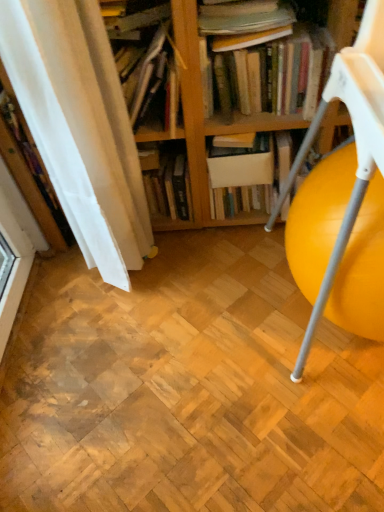
Question: Is yellow plastic ball at right closer to camera compared to hardcover books at upper center, which appears as the 3th book when viewed from the left?

Choices:
 (A) yes
 (B) no

Answer: (A)

Question: Can we say yellow plastic ball at right lies outside hardcover books at upper center, which appears as the 3th book when viewed from the left?

Choices:
 (A) yes
 (B) no

Answer: (A)

Question: Can you confirm if yellow plastic ball at right is positioned to the right of hardcover books at upper center, the first book viewed from the right?

Choices:
 (A) yes
 (B) no

Answer: (A)

Question: Is yellow plastic ball at right smaller than hardcover books at upper center, the first book viewed from the right?

Choices:
 (A) yes
 (B) no

Answer: (B)

Question: From the image's perspective, is yellow plastic ball at right on top of hardcover books at upper center, which appears as the 3th book when viewed from the left?

Choices:
 (A) no
 (B) yes

Answer: (A)

Question: From a real-world perspective, is hardcover book at center, which appears as the second book when viewed from the right, above or below wooden bookshelf at upper center, positioned as the third book in right-to-left order?

Choices:
 (A) below
 (B) above

Answer: (A)

Question: In the image, is hardcover book at center, which appears as the second book when viewed from the right, on the left side or the right side of wooden bookshelf at upper center, positioned as the third book in right-to-left order?

Choices:
 (A) left
 (B) right

Answer: (B)

Question: Considering the positions of hardcover book at center, which appears as the second book when viewed from the right, and wooden bookshelf at upper center, positioned as the third book in right-to-left order, in the image, is hardcover book at center, which appears as the second book when viewed from the right, taller or shorter than wooden bookshelf at upper center, positioned as the third book in right-to-left order,?

Choices:
 (A) short
 (B) tall

Answer: (A)

Question: Does point (150, 193) appear closer or farther from the camera than point (155, 8)?

Choices:
 (A) farther
 (B) closer

Answer: (A)

Question: Looking at the image, does hardcover books at upper center, the first book viewed from the right, seem bigger or smaller compared to white matte book at center?

Choices:
 (A) big
 (B) small

Answer: (A)

Question: From the image's perspective, is hardcover books at upper center, the first book viewed from the right, located above or below white matte book at center?

Choices:
 (A) above
 (B) below

Answer: (A)

Question: Considering the positions of hardcover books at upper center, the first book viewed from the right, and white matte book at center in the image, is hardcover books at upper center, the first book viewed from the right, wider or thinner than white matte book at center?

Choices:
 (A) thin
 (B) wide

Answer: (A)

Question: From a real-world perspective, is hardcover books at upper center, the first book viewed from the right, physically located above or below white matte book at center?

Choices:
 (A) above
 (B) below

Answer: (A)

Question: Considering the positions of white matte book at center and white fabric curtain at left in the image, is white matte book at center taller or shorter than white fabric curtain at left?

Choices:
 (A) short
 (B) tall

Answer: (A)

Question: From the image's perspective, is white matte book at center located above or below white fabric curtain at left?

Choices:
 (A) above
 (B) below

Answer: (B)